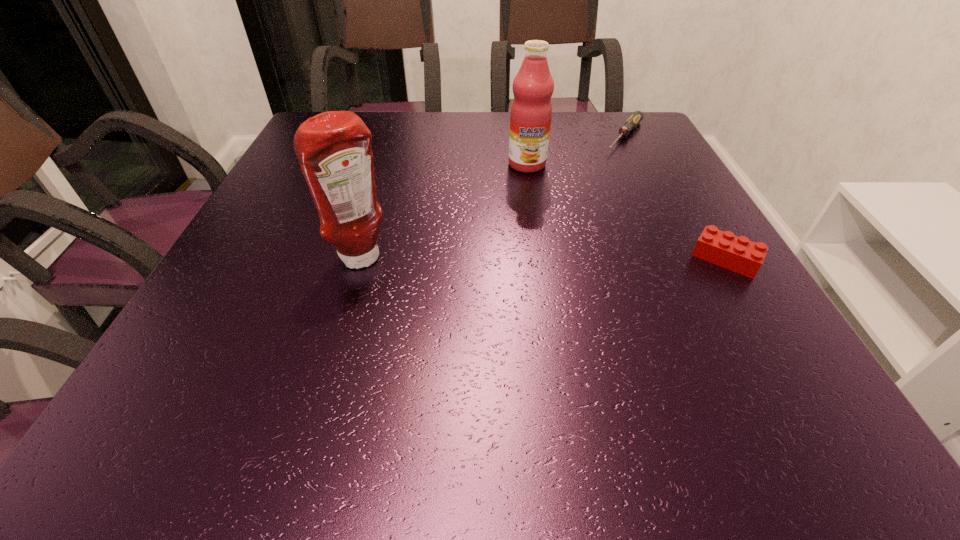
Find the location of `the leftmost object`. the leftmost object is located at coordinates (333, 148).

The width and height of the screenshot is (960, 540). In order to click on Lego in this screenshot , I will do `click(739, 254)`.

You are a GUI agent. You are given a task and a screenshot of the screen. Output one action in this format:
    pyautogui.click(x=<x>, y=<y>)
    Task: Click on the third object from right to left
    This screenshot has width=960, height=540.
    Given the screenshot: What is the action you would take?
    [531, 111]

The height and width of the screenshot is (540, 960). Find the location of `fruit juice`. fruit juice is located at coordinates (531, 111).

What are the coordinates of `the farthest object` in the screenshot? It's located at (637, 116).

Locate an element on the screen. The image size is (960, 540). screwdriver is located at coordinates (637, 116).

Find the location of a particular element. The height and width of the screenshot is (540, 960). free space located 0.120m on the left of the leftmost object is located at coordinates (273, 259).

Find the location of a particular element. The width and height of the screenshot is (960, 540). vacant position located 0.340m on the left of the Lego is located at coordinates (516, 259).

The image size is (960, 540). I want to click on vacant region located on the label of the fruit juice, so click(530, 233).

Where is `vacant space located on the label of the fruit juice`? vacant space located on the label of the fruit juice is located at coordinates (529, 213).